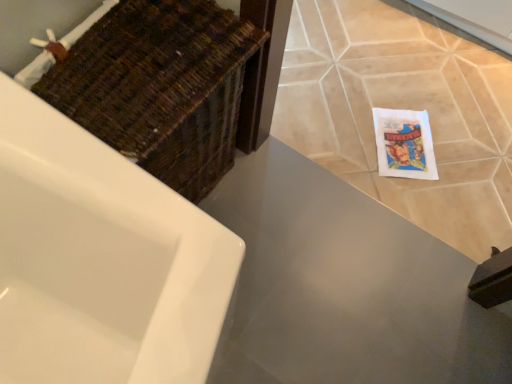
You are a GUI agent. You are given a task and a screenshot of the screen. Output one action in this format:
    pyautogui.click(x=<x>, y=<y>)
    Task: Click on the matte gray countertop at center
    This screenshot has width=512, height=384.
    Given the screenshot: What is the action you would take?
    pyautogui.click(x=344, y=286)

This screenshot has height=384, width=512. I want to click on woven brown basket at upper left, so click(160, 86).

This screenshot has width=512, height=384. Find the location of `matte gray countertop at center`. matte gray countertop at center is located at coordinates (344, 286).

Is woven brown basket at upper left bigger or smaller than beige ceramic tile at lower right?

Considering their sizes, woven brown basket at upper left takes up more space than beige ceramic tile at lower right.

From a real-world perspective, is woven brown basket at upper left positioned above or below beige ceramic tile at lower right?

Clearly, from a real-world perspective, woven brown basket at upper left is above beige ceramic tile at lower right.

Considering the relative positions of woven brown basket at upper left and beige ceramic tile at lower right in the image provided, is woven brown basket at upper left to the left of beige ceramic tile at lower right from the viewer's perspective?

Yes.

Which object is closer to the camera taking this photo, woven brown basket at upper left or beige ceramic tile at lower right?

woven brown basket at upper left is in front.

Identify the location of basket on the left of beige ceramic tile at lower right. The height and width of the screenshot is (384, 512). (160, 86).

Considering the sizes of beige ceramic tile at lower right and woven brown basket at upper left in the image, is beige ceramic tile at lower right bigger or smaller than woven brown basket at upper left?

In the image, beige ceramic tile at lower right appears to be smaller than woven brown basket at upper left.

Considering the sizes of beige ceramic tile at lower right and woven brown basket at upper left in the image, is beige ceramic tile at lower right wider or thinner than woven brown basket at upper left?

In the image, beige ceramic tile at lower right appears to be wider than woven brown basket at upper left.

Is beige ceramic tile at lower right oriented away from woven brown basket at upper left?

No, beige ceramic tile at lower right is not facing the opposite direction of woven brown basket at upper left.

You are a GUI agent. You are given a task and a screenshot of the screen. Output one action in this format:
    pyautogui.click(x=<x>, y=<y>)
    Task: Click on the basket lying on the left of matte gray countertop at center
    
    Given the screenshot: What is the action you would take?
    pyautogui.click(x=160, y=86)

Can you confirm if matte gray countertop at center is wider than woven brown basket at upper left?

Correct, the width of matte gray countertop at center exceeds that of woven brown basket at upper left.

Can you confirm if matte gray countertop at center is positioned to the left of woven brown basket at upper left?

Incorrect, matte gray countertop at center is not on the left side of woven brown basket at upper left.

From the image's perspective, which object appears higher, matte gray countertop at center or beige ceramic tile at lower right?

beige ceramic tile at lower right appears higher in the image.

Is matte gray countertop at center to the left or to the right of beige ceramic tile at lower right in the image?

matte gray countertop at center is positioned on beige ceramic tile at lower right's left side.

Is matte gray countertop at center beside beige ceramic tile at lower right?

No, matte gray countertop at center is not beside beige ceramic tile at lower right.

Based on the photo, is beige ceramic tile at lower right spatially inside matte gray countertop at center, or outside of it?

beige ceramic tile at lower right exists outside the volume of matte gray countertop at center.

From the picture: From a real-world perspective, is beige ceramic tile at lower right under matte gray countertop at center?

No, from a real-world perspective, beige ceramic tile at lower right is not below matte gray countertop at center.

Does beige ceramic tile at lower right turn towards matte gray countertop at center?

Yes, beige ceramic tile at lower right is facing matte gray countertop at center.

Considering the relative sizes of woven brown basket at upper left and matte gray countertop at center in the image provided, is woven brown basket at upper left smaller than matte gray countertop at center?

No.

Is matte gray countertop at center inside woven brown basket at upper left?

Definitely not — matte gray countertop at center is not inside woven brown basket at upper left.

Is woven brown basket at upper left facing away from matte gray countertop at center?

woven brown basket at upper left is not turned away from matte gray countertop at center.

Identify the location of basket on the left of beige ceramic tile at lower right. The width and height of the screenshot is (512, 384). (160, 86).

You are a GUI agent. You are given a task and a screenshot of the screen. Output one action in this format:
    pyautogui.click(x=<x>, y=<y>)
    Task: Click on the ceramic tile below the woven brown basket at upper left (from a real-world perspective)
    The width and height of the screenshot is (512, 384).
    Given the screenshot: What is the action you would take?
    pyautogui.click(x=403, y=108)

When comparing their distances from woven brown basket at upper left, does matte gray countertop at center or beige ceramic tile at lower right seem closer?

matte gray countertop at center.

Which object lies nearer to the anchor point matte gray countertop at center, beige ceramic tile at lower right or woven brown basket at upper left?

beige ceramic tile at lower right is positioned closer to the anchor matte gray countertop at center.

From the image, which object appears to be nearer to woven brown basket at upper left, beige ceramic tile at lower right or matte gray countertop at center?

Among the two, matte gray countertop at center is located nearer to woven brown basket at upper left.

Estimate the real-world distances between objects in this image. Which object is closer to matte gray countertop at center, woven brown basket at upper left or beige ceramic tile at lower right?

beige ceramic tile at lower right.

Estimate the real-world distances between objects in this image. Which object is closer to beige ceramic tile at lower right, woven brown basket at upper left or matte gray countertop at center?

Based on the image, matte gray countertop at center appears to be nearer to beige ceramic tile at lower right.

When comparing their distances from beige ceramic tile at lower right, does matte gray countertop at center or woven brown basket at upper left seem closer?

matte gray countertop at center.

Where is `counter top between woven brown basket at upper left and beige ceramic tile at lower right`? The height and width of the screenshot is (384, 512). counter top between woven brown basket at upper left and beige ceramic tile at lower right is located at coordinates (344, 286).